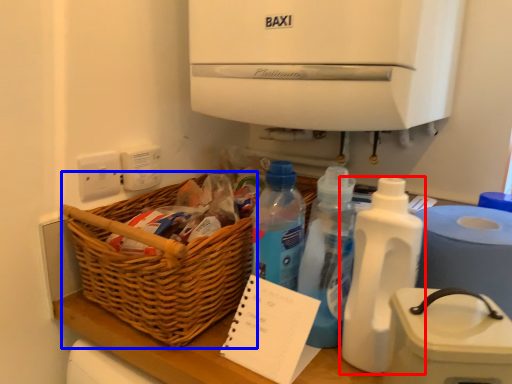
Question: Which object appears closest to the camera in this image, bottle (highlighted by a red box) or basket (highlighted by a blue box)?

Choices:
 (A) bottle
 (B) basket

Answer: (A)